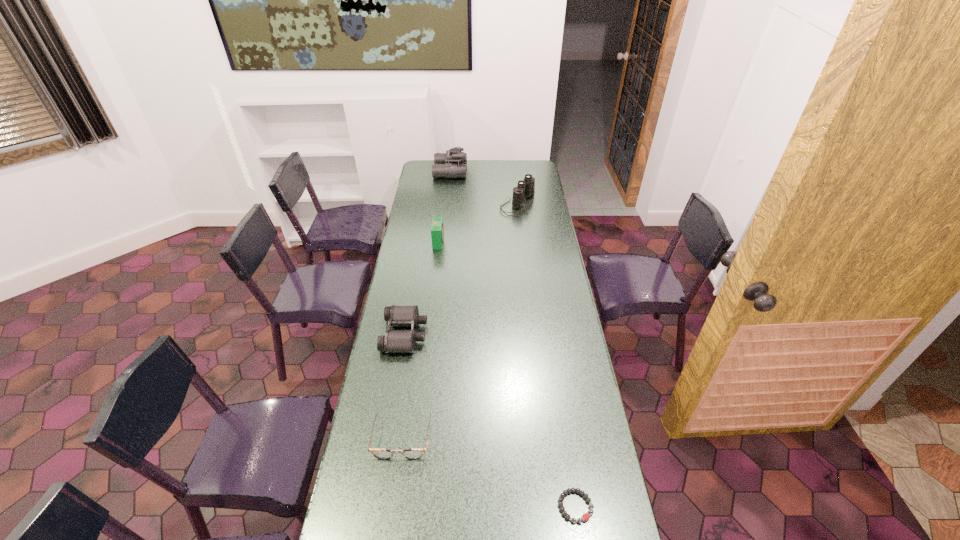
What are the coordinates of `the shortest object` in the screenshot? It's located at (585, 517).

Find the location of a particular element. The image size is (960, 540). free spot located 0.300m through the lenses of the farthest object is located at coordinates (516, 172).

The height and width of the screenshot is (540, 960). Identify the location of free space located on the right of the fifth nearest object. (545, 205).

The image size is (960, 540). I want to click on vacant area situated 0.220m on the front-facing side of the alarm clock, so click(489, 242).

Locate an element on the screen. vacant space situated 0.370m through the eyepieces of the fourth tallest object is located at coordinates (521, 334).

Where is `vacant point located on the frame of the second shortest object`? The image size is (960, 540). vacant point located on the frame of the second shortest object is located at coordinates (392, 512).

I want to click on free space located 0.290m on the left of the shortest object, so click(x=455, y=506).

What are the coordinates of `object positioned at the far edge` in the screenshot? It's located at (452, 164).

Find the location of a particular element. alarm clock that is at the left edge is located at coordinates (437, 230).

The image size is (960, 540). Identify the location of spectacles that is at the left edge. (x=378, y=453).